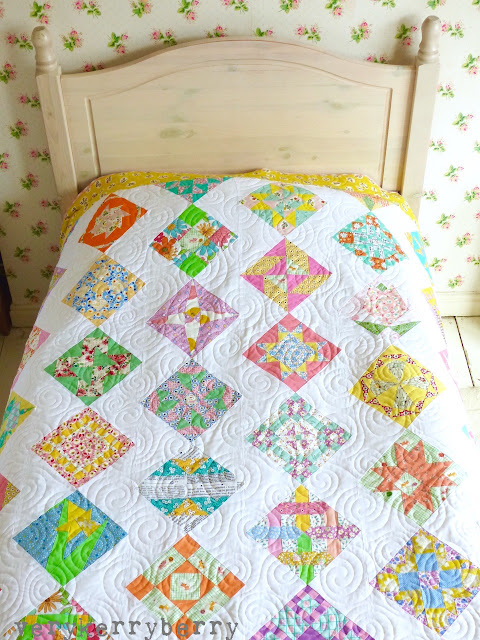
You are a GUI agent. You are given a task and a screenshot of the screen. Output one action in this format:
    pyautogui.click(x=<x>, y=<y>)
    Task: Click on the headboard
    The width and height of the screenshot is (480, 640).
    Given the screenshot: What is the action you would take?
    pyautogui.click(x=269, y=111)